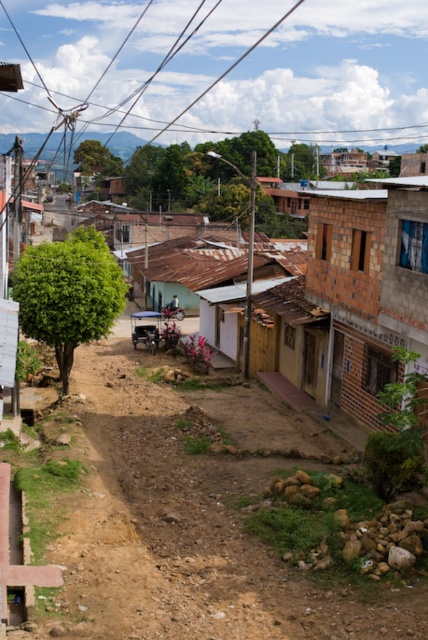
Who is more forward, [341,234] or [421,314]?

Point [421,314] is more forward.

Find the location of `brown brick house at center`. brown brick house at center is located at coordinates (356, 292).

The image size is (428, 640). Identify the location of brown brick house at center. (356, 292).

Does brown dirt track at center lie behind brown brick house at center?

No, brown dirt track at center is in front of brown brick house at center.

Between brown dirt track at center and brown brick house at center, which one has less height?

With less height is brown dirt track at center.

Is point (226, 595) more distant than point (309, 344)?

No, (226, 595) is in front of (309, 344).

I want to click on brown dirt track at center, so click(x=204, y=518).

Between brown dirt track at center and brick wall house at right, which one is positioned lower?

brown dirt track at center is lower down.

Is brown dirt track at center shorter than brick wall house at right?

Correct, brown dirt track at center is not as tall as brick wall house at right.

You are a GUI agent. You are given a task and a screenshot of the screen. Output one action in this format:
    pyautogui.click(x=<x>, y=<y>)
    Task: Click on the brown dirt track at center
    
    Given the screenshot: What is the action you would take?
    pyautogui.click(x=204, y=518)